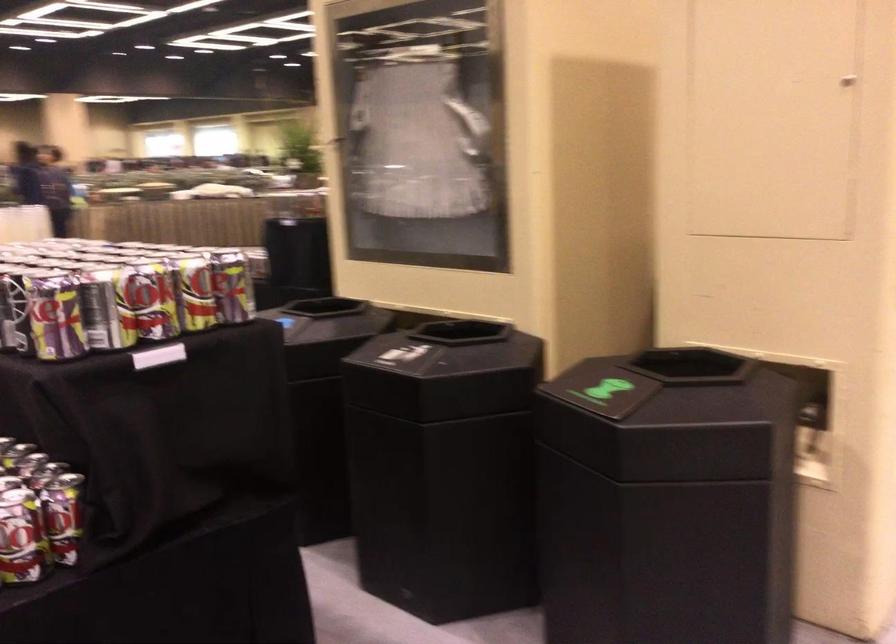
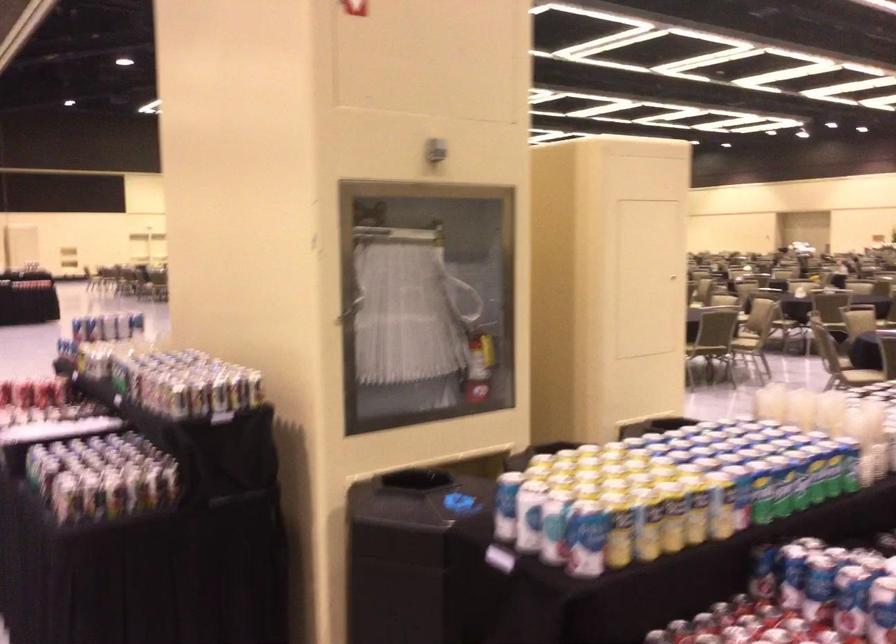
In the second image, find the point that corresponds to the point at 495,223 in the first image.

(478, 365)